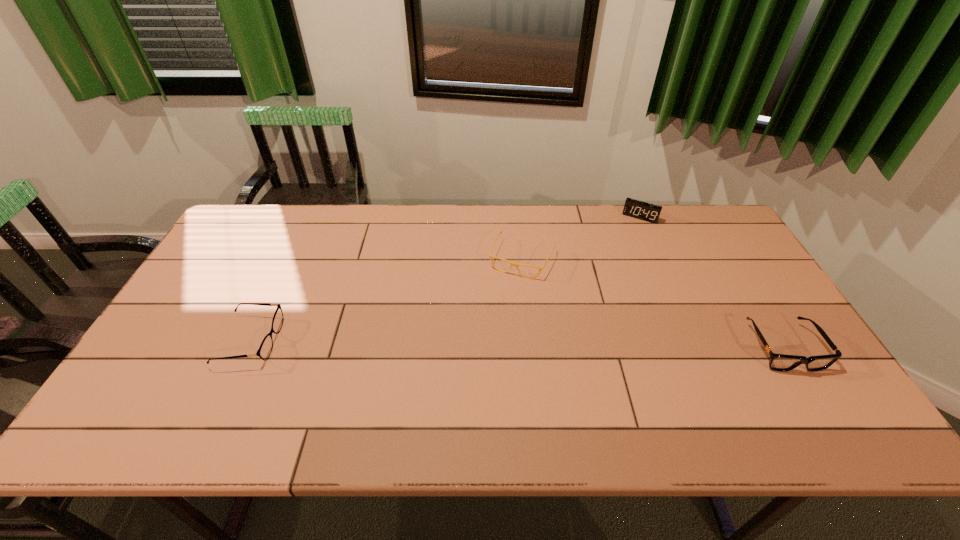
In the image, there is a desktop. Identify the location of vacant space at the far edge. This screenshot has height=540, width=960. (404, 236).

Where is `vacant space at the near edge of the desktop`? The image size is (960, 540). vacant space at the near edge of the desktop is located at coordinates (423, 386).

In the image, there is a desktop. At what (x,y) coordinates should I click in order to perform the action: click on vacant space at the right edge. Please return your answer as a coordinate pair (x, y). Looking at the image, I should click on (713, 273).

This screenshot has width=960, height=540. In order to click on vacant space at the far right corner of the desktop in this screenshot , I will do `click(708, 214)`.

Locate an element on the screen. Image resolution: width=960 pixels, height=540 pixels. free space between the sunglasses and the third object from left to right is located at coordinates (711, 282).

At what (x,y) coordinates should I click in order to perform the action: click on vacant space that's between the right spectacles and the sunglasses. Please return your answer as a coordinate pair (x, y). Image resolution: width=960 pixels, height=540 pixels. Looking at the image, I should click on (653, 303).

At what (x,y) coordinates should I click in order to perform the action: click on vacant area that lies between the second farthest object and the alarm clock. Please return your answer as a coordinate pair (x, y). Looking at the image, I should click on (581, 238).

This screenshot has height=540, width=960. In order to click on free space between the farthest object and the farther spectacles in this screenshot , I will do `click(581, 238)`.

What are the coordinates of `free space between the sunglasses and the third object from right to left` in the screenshot? It's located at (653, 303).

The width and height of the screenshot is (960, 540). I want to click on free spot between the sunglasses and the right spectacles, so click(653, 303).